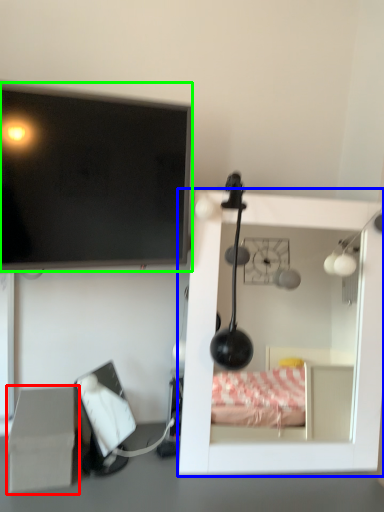
Question: Based on their relative distances, which object is nearer to cardboard box (highlighted by a red box)? Choose from furniture (highlighted by a blue box) and television (highlighted by a green box).

Choices:
 (A) furniture
 (B) television

Answer: (B)